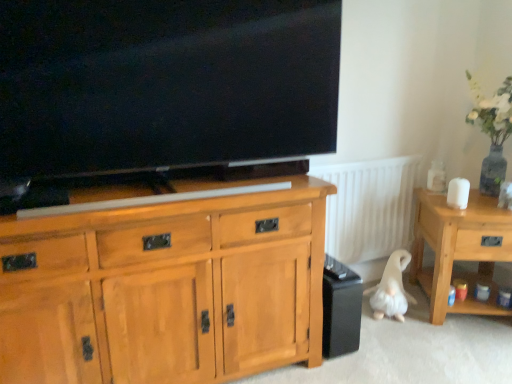
Question: Is matte black tv at upper center behind white plush dog at lower right?

Choices:
 (A) no
 (B) yes

Answer: (A)

Question: Can you confirm if matte black tv at upper center is taller than white plush dog at lower right?

Choices:
 (A) no
 (B) yes

Answer: (B)

Question: Is matte black tv at upper center facing away from white plush dog at lower right?

Choices:
 (A) yes
 (B) no

Answer: (B)

Question: Does matte black tv at upper center have a smaller size compared to white plush dog at lower right?

Choices:
 (A) yes
 (B) no

Answer: (B)

Question: Considering the relative positions of matte black tv at upper center and white plush dog at lower right in the image provided, is matte black tv at upper center to the left of white plush dog at lower right from the viewer's perspective?

Choices:
 (A) yes
 (B) no

Answer: (A)

Question: From a real-world perspective, is light brown wood cabinet at center physically located above or below white ribbed radiator at center?

Choices:
 (A) below
 (B) above

Answer: (A)

Question: Does point pos(3,339) appear closer or farther from the camera than point pos(370,248)?

Choices:
 (A) closer
 (B) farther

Answer: (A)

Question: Is light brown wood cabinet at center to the left or to the right of white ribbed radiator at center in the image?

Choices:
 (A) right
 (B) left

Answer: (B)

Question: Considering the positions of light brown wood cabinet at center and white ribbed radiator at center in the image, is light brown wood cabinet at center taller or shorter than white ribbed radiator at center?

Choices:
 (A) short
 (B) tall

Answer: (B)

Question: Visually, is white plush dog at lower right positioned to the left or to the right of white ribbed radiator at center?

Choices:
 (A) left
 (B) right

Answer: (B)

Question: Looking at the image, does white plush dog at lower right seem bigger or smaller compared to white ribbed radiator at center?

Choices:
 (A) big
 (B) small

Answer: (B)

Question: Considering the positions of white plush dog at lower right and white ribbed radiator at center in the image, is white plush dog at lower right taller or shorter than white ribbed radiator at center?

Choices:
 (A) short
 (B) tall

Answer: (A)

Question: From a real-world perspective, is white plush dog at lower right physically located above or below white ribbed radiator at center?

Choices:
 (A) below
 (B) above

Answer: (A)

Question: Considering the positions of light wood side table at right and white plush dog at lower right in the image, is light wood side table at right taller or shorter than white plush dog at lower right?

Choices:
 (A) short
 (B) tall

Answer: (B)

Question: From the image's perspective, relative to white plush dog at lower right, is light wood side table at right above or below?

Choices:
 (A) below
 (B) above

Answer: (B)